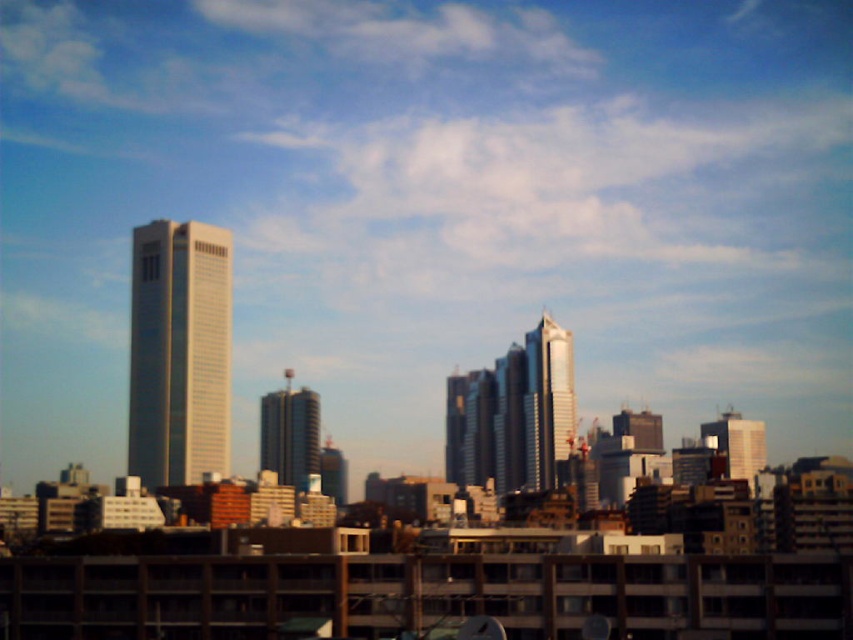
Is white glossy building at left shorter than metallic glass building at center?

In fact, white glossy building at left may be taller than metallic glass building at center.

How distant is white glossy building at left from metallic glass building at center?

A distance of 43.10 meters exists between white glossy building at left and metallic glass building at center.

Where is `white glossy building at left`? The image size is (853, 640). white glossy building at left is located at coordinates (178, 353).

Looking at this image, who is more distant from viewer, (x=564, y=358) or (x=283, y=396)?

The point (x=564, y=358) is more distant.

Is shiny silver skyscraper at center taller than metallic glass building at center?

Correct, shiny silver skyscraper at center is much taller as metallic glass building at center.

Is point (543, 312) positioned after point (270, 448)?

That is True.

The width and height of the screenshot is (853, 640). Find the location of `shiny silver skyscraper at center`. shiny silver skyscraper at center is located at coordinates (548, 401).

Is point (199, 401) positioned behind point (546, 458)?

That is False.

Is white glossy building at left smaller than shiny silver skyscraper at center?

No, white glossy building at left is not smaller than shiny silver skyscraper at center.

The image size is (853, 640). In order to click on white glossy building at left in this screenshot , I will do tap(178, 353).